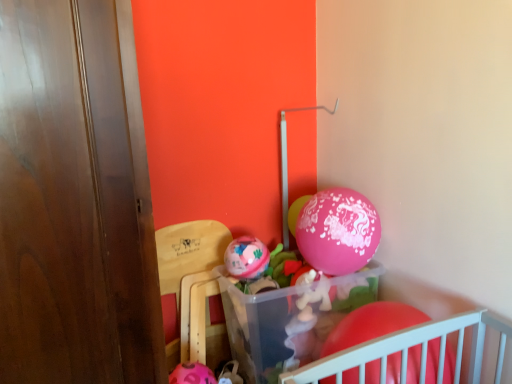
Question: In terms of width, does wooden chair at lower left look wider or thinner when compared to pink glossy balloon at center, which is the third balloon from front to back?

Choices:
 (A) thin
 (B) wide

Answer: (B)

Question: In the image, is wooden chair at lower left on the left side or the right side of pink glossy balloon at center, acting as the 3th balloon starting from the bottom?

Choices:
 (A) left
 (B) right

Answer: (A)

Question: Which object is the farthest from the rubber matte balloon at lower right, the 3th balloon when ordered from back to front?

Choices:
 (A) wooden chair at lower left
 (B) pink glossy balloon at center, which is the third balloon from front to back
 (C) matte pink balloon at center, the 2th balloon when ordered from bottom to top

Answer: (A)

Question: Estimate the real-world distances between objects in this image. Which object is farther from the wooden chair at lower left?

Choices:
 (A) matte pink balloon at center, arranged as the second balloon when viewed from the front
 (B) pink glossy balloon at center, the 1th balloon positioned from the back
 (C) rubber matte balloon at lower right, the third balloon viewed from the top

Answer: (C)